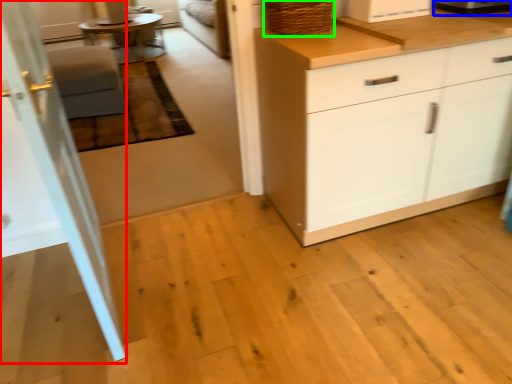
Question: Which object is positioned closest to screen door (highlighted by a red box)? Select from appliance (highlighted by a blue box) and basket (highlighted by a green box).

Choices:
 (A) appliance
 (B) basket

Answer: (B)